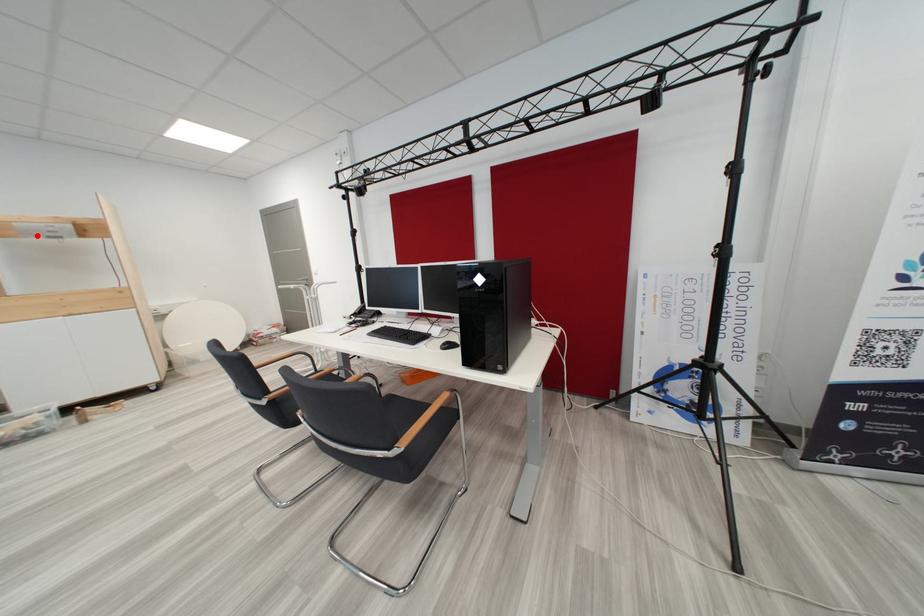
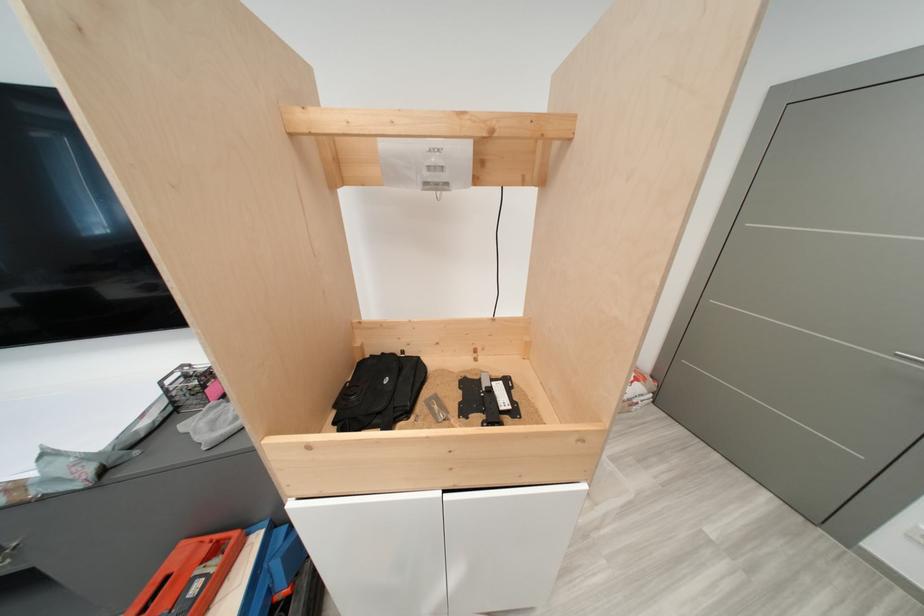
Question: I am providing you with two images of the same scene from different viewpoints. Image1 has a red point marked. In image2, the corresponding 3D location appears at what relative position? Reply with the corresponding letter.

Choices:
 (A) Closer
 (B) Farther

Answer: (A)